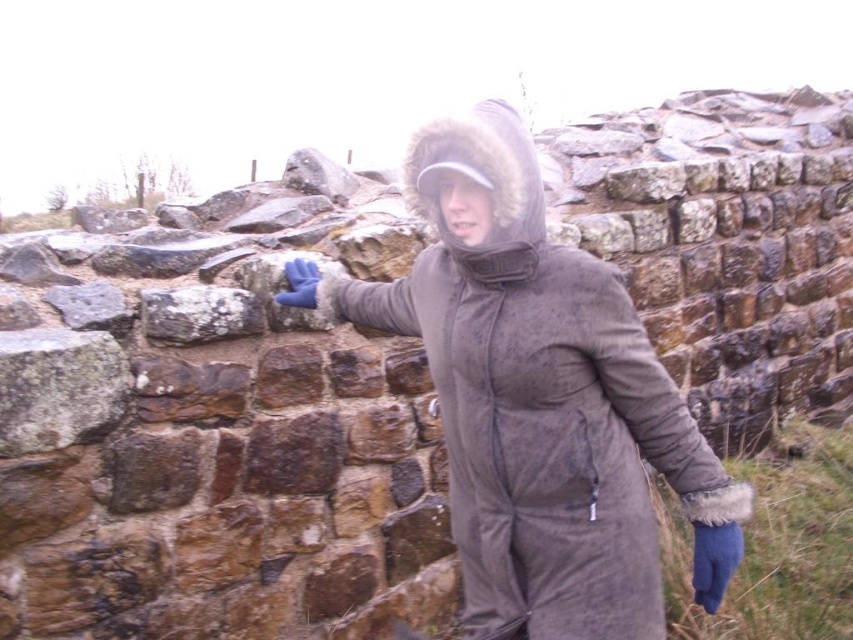
Does speckled stone at upper left have a smaller size compared to blue synthetic glove at upper center?

No.

Is speckled stone at upper left to the right of blue synthetic glove at upper center from the viewer's perspective?

No, speckled stone at upper left is not to the right of blue synthetic glove at upper center.

You are a GUI agent. You are given a task and a screenshot of the screen. Output one action in this format:
    pyautogui.click(x=<x>, y=<y>)
    Task: Click on the speckled stone at upper left
    This screenshot has width=853, height=640.
    Given the screenshot: What is the action you would take?
    pyautogui.click(x=199, y=314)

Where is `speckled stone at upper left`? The image size is (853, 640). speckled stone at upper left is located at coordinates (199, 314).

Which is in front, point (569, 268) or point (293, 289)?

Positioned in front is point (569, 268).

This screenshot has width=853, height=640. What do you see at coordinates (543, 401) in the screenshot? I see `brown fuzzy coat at center` at bounding box center [543, 401].

Describe the element at coordinates (543, 401) in the screenshot. I see `brown fuzzy coat at center` at that location.

This screenshot has width=853, height=640. Find the location of `brown fuzzy coat at center`. brown fuzzy coat at center is located at coordinates (543, 401).

Can you confirm if brown fuzzy coat at center is positioned to the right of speckled stone at upper left?

Correct, you'll find brown fuzzy coat at center to the right of speckled stone at upper left.

Is brown fuzzy coat at center above speckled stone at upper left?

Actually, brown fuzzy coat at center is below speckled stone at upper left.

Which is in front, point (479, 141) or point (167, 321)?

Positioned in front is point (479, 141).

Identify the location of brown fuzzy coat at center. (543, 401).